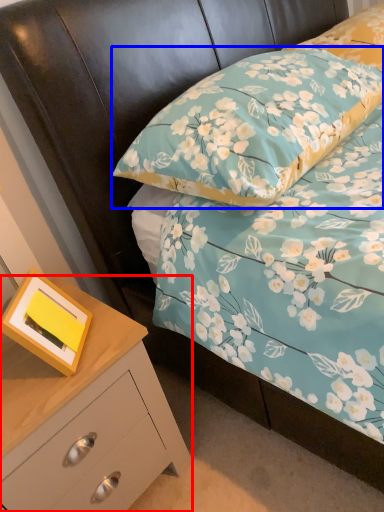
Question: Which object is closer to the camera taking this photo, chest of drawers (highlighted by a red box) or pillow (highlighted by a blue box)?

Choices:
 (A) chest of drawers
 (B) pillow

Answer: (A)